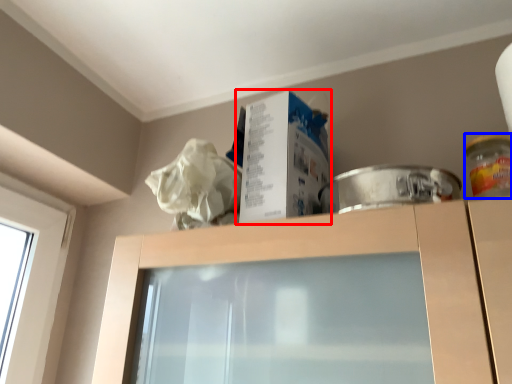
Question: Which object is further to the camera taking this photo, box (highlighted by a red box) or glass jar (highlighted by a blue box)?

Choices:
 (A) box
 (B) glass jar

Answer: (A)